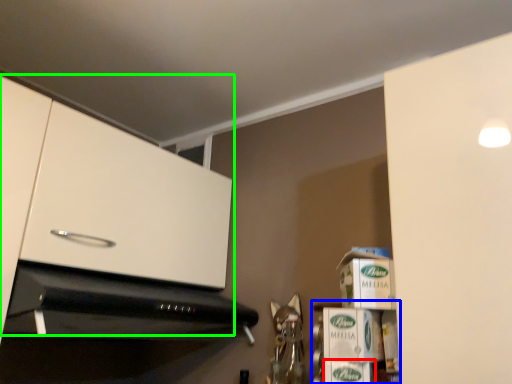
Question: Which object is the closest to the cardboard box (highlighted by a red box)? Choose among these: shelf (highlighted by a blue box) or cabinetry (highlighted by a green box).

Choices:
 (A) shelf
 (B) cabinetry

Answer: (A)